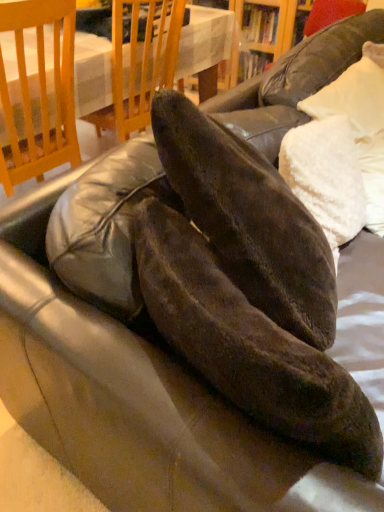
You are a GUI agent. You are given a task and a screenshot of the screen. Output one action in this format:
    pyautogui.click(x=<x>, y=<y>)
    Task: Click on the white fluffy pillow at upper right
    The image size is (384, 512).
    Given the screenshot: What is the action you would take?
    pyautogui.click(x=326, y=177)

Where is `matte black shoe at center`? The image size is (384, 512). matte black shoe at center is located at coordinates (248, 346).

Are matte black shoe at center and wooden table at upper center beside each other?

No, matte black shoe at center is not next to wooden table at upper center.

From a real-world perspective, is matte black shoe at center positioned above or below wooden table at upper center?

matte black shoe at center is above wooden table at upper center.

Which is further, (x=238, y=298) or (x=49, y=69)?

The point (x=49, y=69) is behind.

Can you confirm if white fluffy pillow at upper right is taller than matte black shoe at center?

No, white fluffy pillow at upper right is not taller than matte black shoe at center.

Can you confirm if white fluffy pillow at upper right is bigger than matte black shoe at center?

Incorrect, white fluffy pillow at upper right is not larger than matte black shoe at center.

Which object is closer to the camera taking this photo, white fluffy pillow at upper right or matte black shoe at center?

matte black shoe at center is more forward.

How many degrees apart are the facing directions of white fluffy pillow at upper right and matte black shoe at center?

The facing directions of white fluffy pillow at upper right and matte black shoe at center are 66.8 degrees apart.

Identify the location of table behind the matte black shoe at center. This screenshot has width=384, height=512. pyautogui.click(x=204, y=41).

Does wooden table at upper center contain matte black shoe at center?

No.

Does wooden table at upper center have a smaller size compared to matte black shoe at center?

No.

Visually, is wooden table at upper center positioned to the left or to the right of matte black shoe at center?

Clearly, wooden table at upper center is on the left of matte black shoe at center in the image.

Is white fluffy pillow at upper right smaller than wooden table at upper center?

Correct, white fluffy pillow at upper right occupies less space than wooden table at upper center.

Considering the relative sizes of white fluffy pillow at upper right and wooden table at upper center in the image provided, is white fluffy pillow at upper right taller than wooden table at upper center?

Incorrect, the height of white fluffy pillow at upper right is not larger of that of wooden table at upper center.

Is white fluffy pillow at upper right touching wooden table at upper center?

white fluffy pillow at upper right and wooden table at upper center are clearly separated.

Is white fluffy pillow at upper right a part of wooden table at upper center?

No, white fluffy pillow at upper right is not a part of wooden table at upper center.

Considering the relative sizes of wooden table at upper center and white fluffy pillow at upper right in the image provided, is wooden table at upper center bigger than white fluffy pillow at upper right?

Yes.

Based on the photo, which is more to the left, wooden table at upper center or white fluffy pillow at upper right?

wooden table at upper center.

From the picture: Is matte black shoe at center taller or shorter than white fluffy pillow at upper right?

Considering their sizes, matte black shoe at center has more height than white fluffy pillow at upper right.

Is matte black shoe at center looking in the opposite direction of white fluffy pillow at upper right?

matte black shoe at center does not have its back to white fluffy pillow at upper right.

There is a white fluffy pillow at upper right. At what (x,y) coordinates should I click in order to perform the action: click on leather shoe above it (from a real-world perspective). Please return your answer as a coordinate pair (x, y). Looking at the image, I should click on (248, 346).

Considering the relative positions of matte black shoe at center and white fluffy pillow at upper right in the image provided, is matte black shoe at center to the right of white fluffy pillow at upper right from the viewer's perspective?

No.

Where is `table beneath the matte black shoe at center (from a real-world perspective)`? The width and height of the screenshot is (384, 512). table beneath the matte black shoe at center (from a real-world perspective) is located at coordinates (204, 41).

Locate an element on the screen. leather shoe below the white fluffy pillow at upper right (from the image's perspective) is located at coordinates (248, 346).

In the scene shown: Looking at the image, which one is located closer to white fluffy pillow at upper right, wooden table at upper center or matte black shoe at center?

The object closer to white fluffy pillow at upper right is matte black shoe at center.

Based on their spatial positions, is white fluffy pillow at upper right or matte black shoe at center closer to wooden table at upper center?

white fluffy pillow at upper right is closer to wooden table at upper center.

Which object lies further to the anchor point wooden table at upper center, matte black shoe at center or white fluffy pillow at upper right?

matte black shoe at center is further to wooden table at upper center.

Considering their positions, is matte black shoe at center positioned further to white fluffy pillow at upper right than wooden table at upper center?

wooden table at upper center lies further to white fluffy pillow at upper right than the other object.

Based on their spatial positions, is white fluffy pillow at upper right or wooden table at upper center closer to matte black shoe at center?

Based on the image, white fluffy pillow at upper right appears to be nearer to matte black shoe at center.

From the image, which object appears to be nearer to matte black shoe at center, wooden table at upper center or white fluffy pillow at upper right?

white fluffy pillow at upper right is positioned closer to the anchor matte black shoe at center.

Locate an element on the screen. pillow positioned between matte black shoe at center and wooden table at upper center from near to far is located at coordinates (326, 177).